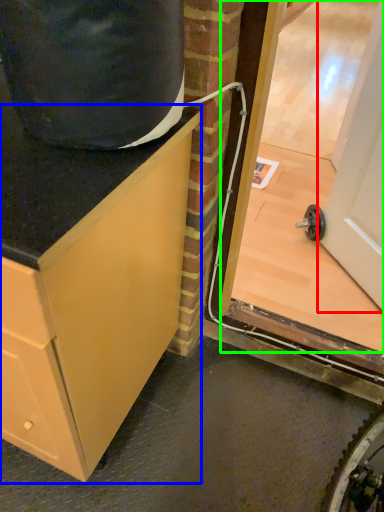
Question: Estimate the real-world distances between objects in this image. Which object is farther from door (highlighted by a red box), cabinetry (highlighted by a blue box) or glass door (highlighted by a green box)?

Choices:
 (A) cabinetry
 (B) glass door

Answer: (A)